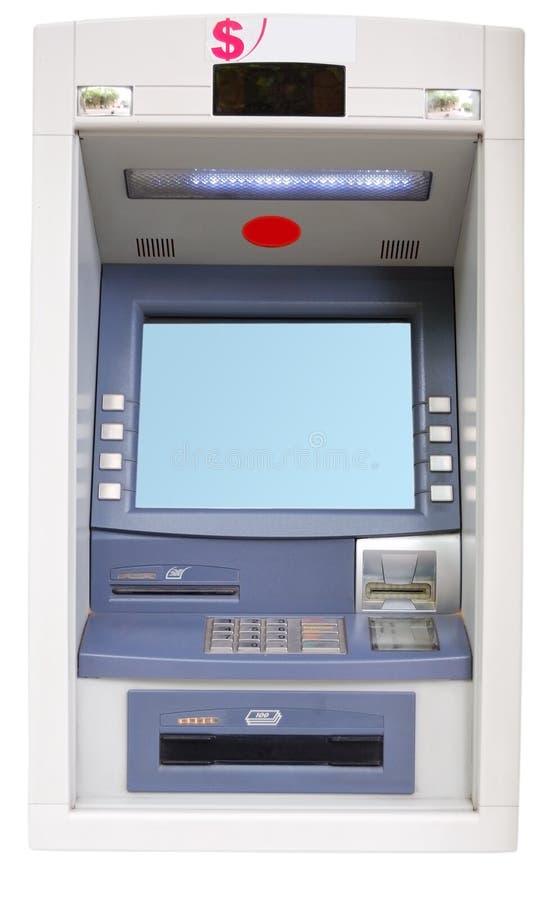
Where is `light`? Image resolution: width=549 pixels, height=900 pixels. light is located at coordinates (287, 184).